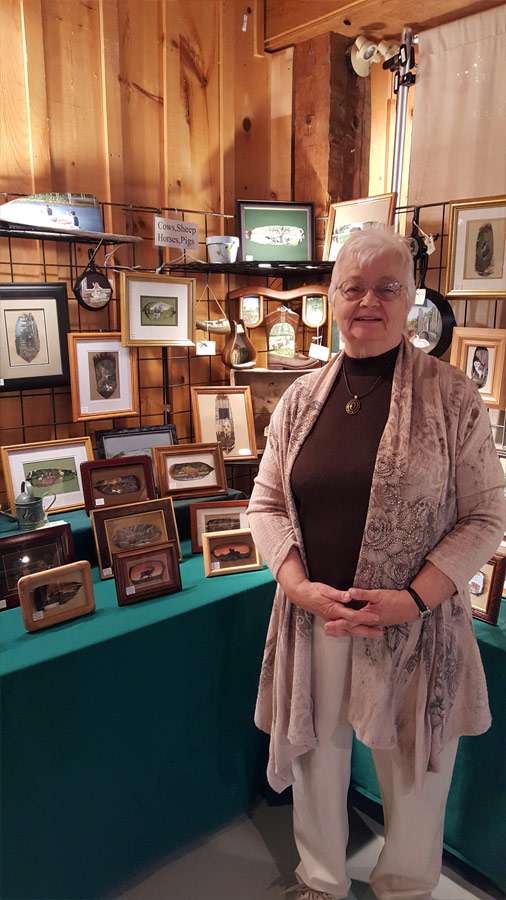
Find the location of a particular element. The width and height of the screenshot is (506, 900). pictures is located at coordinates (64, 214).